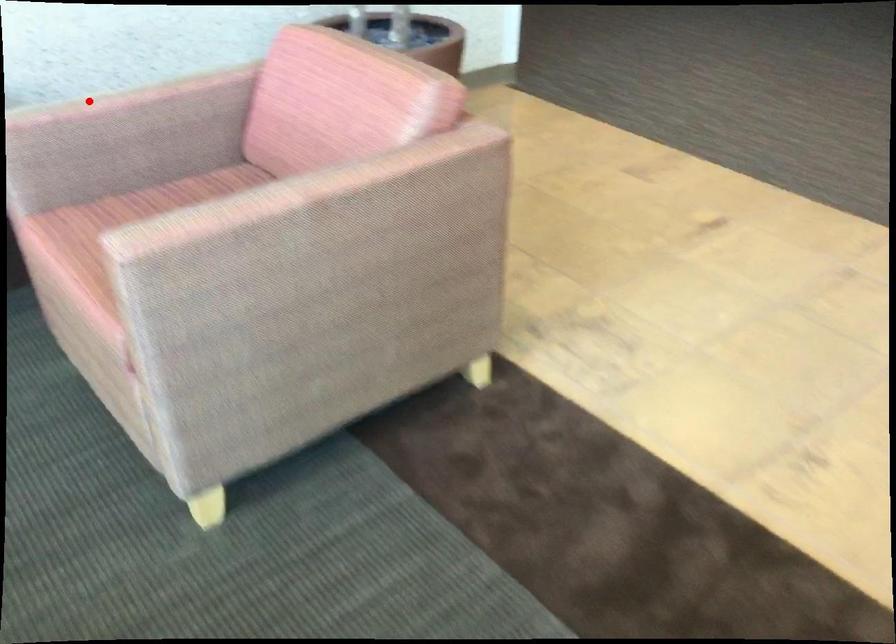
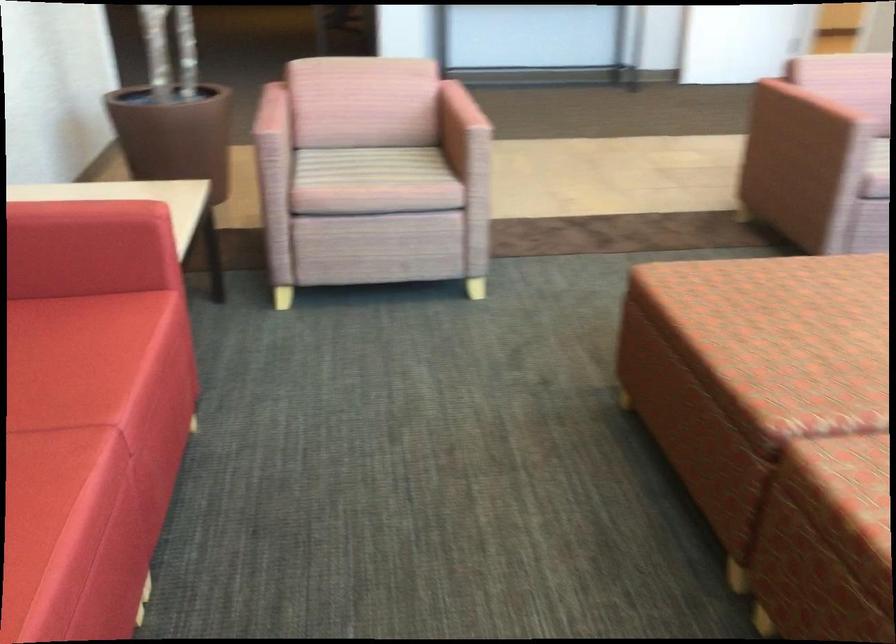
The point at the highlighted location is marked in the first image. Where is the corresponding point in the second image?

(271, 113)